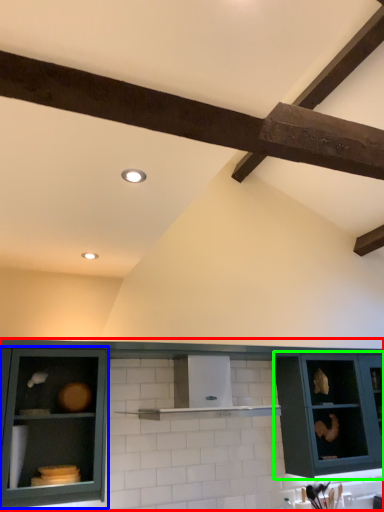
Question: Which object is the closest to the cabinetry (highlighted by a red box)? Choose among these: cabinetry (highlighted by a blue box) or cabinetry (highlighted by a green box).

Choices:
 (A) cabinetry
 (B) cabinetry

Answer: (A)